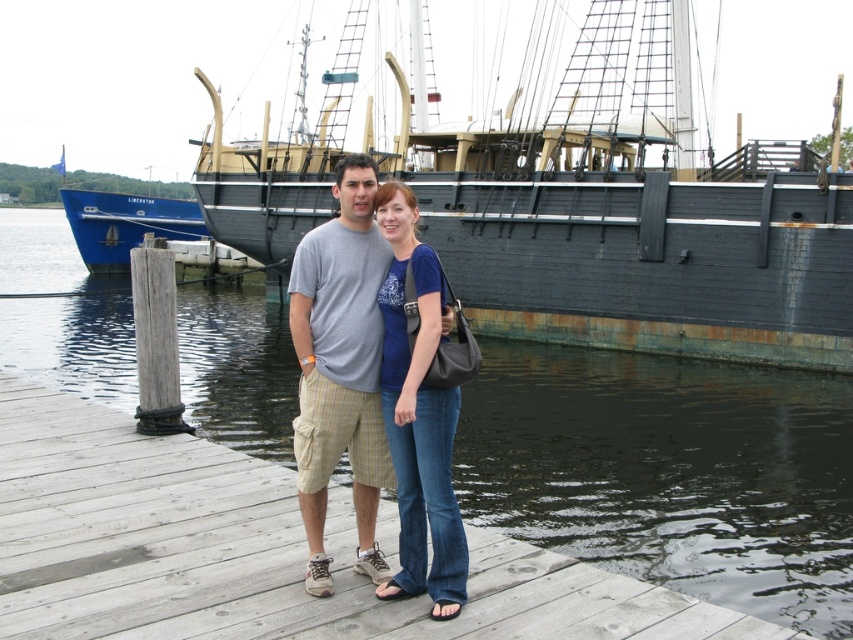
You are a photographer trying to capture a wide shot of the scene. The dark water at dock center and the rusty wooden ship at center are both in the frame. Which object takes up more horizontal space in the photo?

The dark water at dock center takes up more horizontal space in the photo because its width is larger than that of the rusty wooden ship at center.